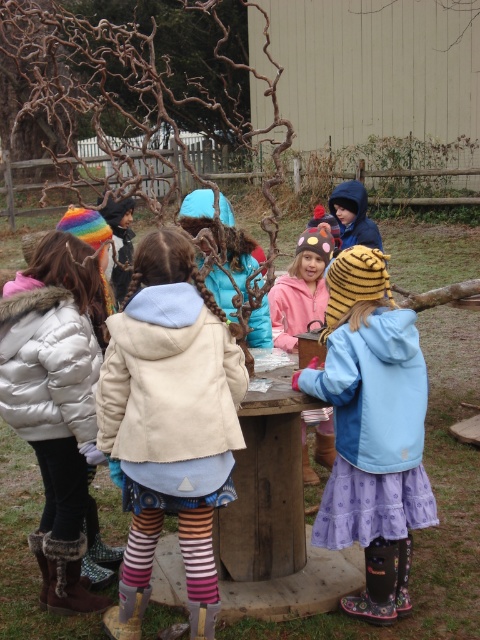
Question: Which of the following is the farthest from the observer?

Choices:
 (A) (74, 356)
 (B) (333, 307)

Answer: (B)

Question: Estimate the real-world distances between objects in this image. Which object is closer to the blue fleece jacket at center?

Choices:
 (A) pink fleece jacket at center
 (B) beige wool coat at center
 (C) white puffy jacket at left

Answer: (B)

Question: Does beige wool coat at center appear under pink fleece jacket at center?

Choices:
 (A) no
 (B) yes

Answer: (B)

Question: Which point is closer to the camera taking this photo?

Choices:
 (A) (297, 344)
 (B) (54, 362)

Answer: (B)

Question: Is beige wool coat at center to the right of white puffy jacket at left from the viewer's perspective?

Choices:
 (A) yes
 (B) no

Answer: (A)

Question: Can you confirm if blue fleece jacket at center is positioned below pink fleece jacket at center?

Choices:
 (A) yes
 (B) no

Answer: (A)